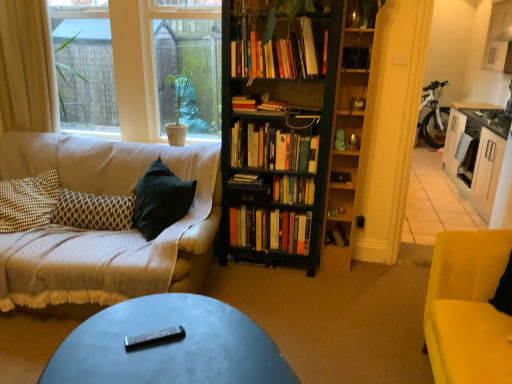
Where is `free location in front of black plastic remote control at center`? free location in front of black plastic remote control at center is located at coordinates click(x=148, y=364).